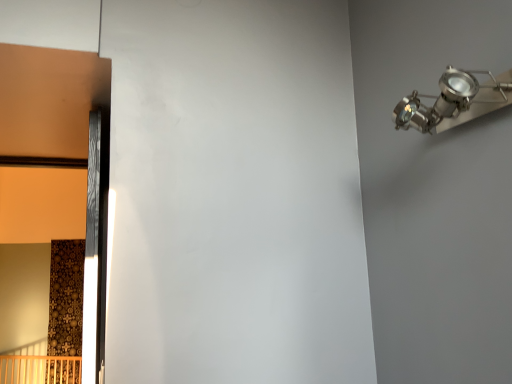
Question: In terms of size, does wooden door at left appear bigger or smaller than metallic silver spotlight at upper right?

Choices:
 (A) small
 (B) big

Answer: (B)

Question: In terms of width, does wooden door at left look wider or thinner when compared to metallic silver spotlight at upper right?

Choices:
 (A) thin
 (B) wide

Answer: (A)

Question: From the image's perspective, is wooden door at left positioned above or below metallic silver spotlight at upper right?

Choices:
 (A) below
 (B) above

Answer: (A)

Question: Is point (411, 119) closer or farther from the camera than point (93, 362)?

Choices:
 (A) farther
 (B) closer

Answer: (B)

Question: Is metallic silver spotlight at upper right in front of or behind wooden door at left in the image?

Choices:
 (A) behind
 (B) front

Answer: (B)

Question: In terms of width, does metallic silver spotlight at upper right look wider or thinner when compared to wooden door at left?

Choices:
 (A) wide
 (B) thin

Answer: (A)

Question: Considering the positions of metallic silver spotlight at upper right and wooden door at left in the image, is metallic silver spotlight at upper right taller or shorter than wooden door at left?

Choices:
 (A) tall
 (B) short

Answer: (B)